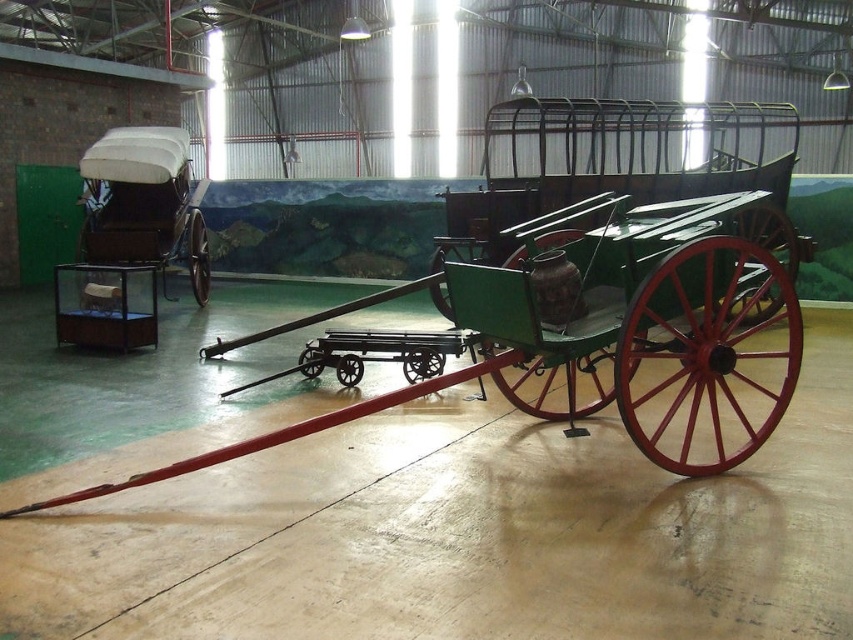
Question: Which of the following is the closest to the observer?

Choices:
 (A) coord(129,248)
 (B) coord(757,291)

Answer: (B)

Question: Is the position of green polished wood horse cart at center less distant than that of white fabric covered wagon at left?

Choices:
 (A) yes
 (B) no

Answer: (A)

Question: Which of the following is the closest to the observer?

Choices:
 (A) green polished wood horse cart at center
 (B) white fabric covered wagon at left

Answer: (A)

Question: Which point is closer to the camera taking this photo?

Choices:
 (A) (722, 268)
 (B) (103, 148)

Answer: (A)

Question: Can you confirm if green polished wood horse cart at center is thinner than white fabric covered wagon at left?

Choices:
 (A) no
 (B) yes

Answer: (A)

Question: Is green polished wood horse cart at center positioned in front of white fabric covered wagon at left?

Choices:
 (A) yes
 (B) no

Answer: (A)